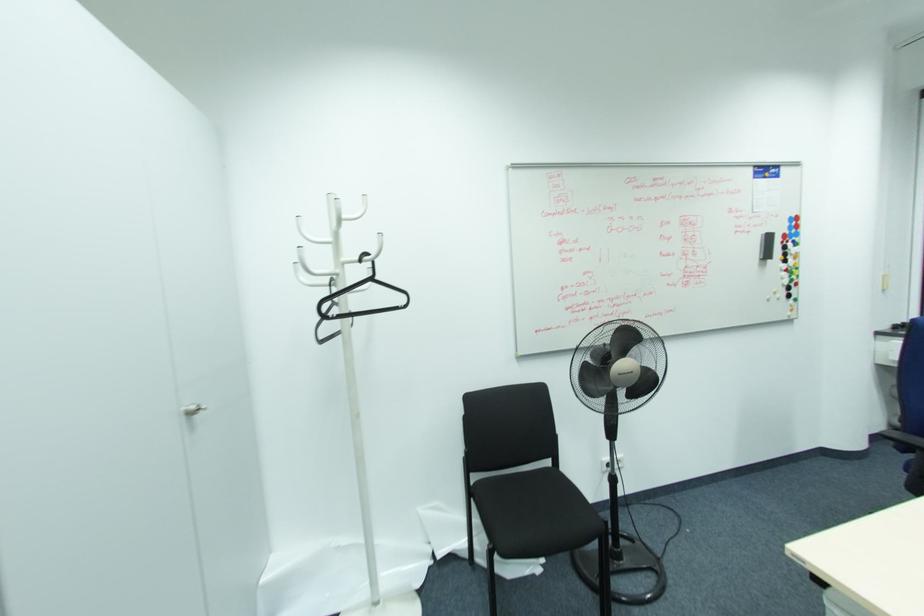
Where is `black clothes hanger`? The image size is (924, 616). black clothes hanger is located at coordinates (353, 302).